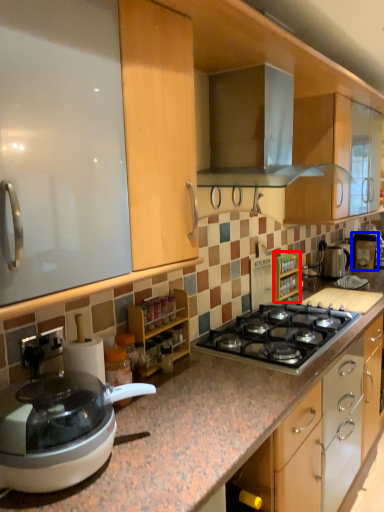
Question: Which object appears farthest to the camera in this image, cabinetry (highlighted by a red box) or coffee machine (highlighted by a blue box)?

Choices:
 (A) cabinetry
 (B) coffee machine

Answer: (B)